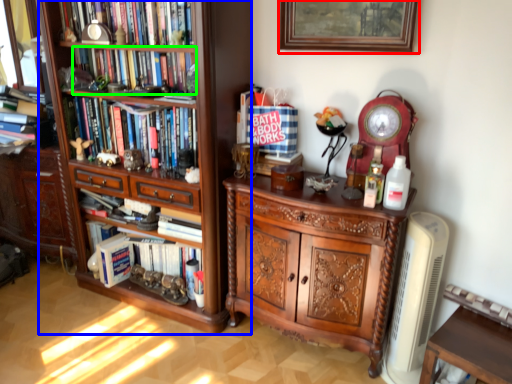
Question: Which object is the closest to the picture frame (highlighted by a red box)? Choose among these: shelf (highlighted by a blue box) or book (highlighted by a green box).

Choices:
 (A) shelf
 (B) book

Answer: (A)